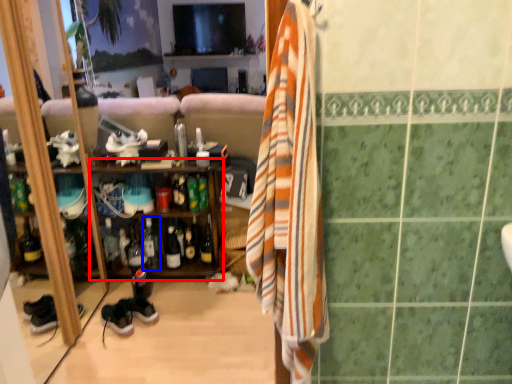
Question: Which object is closer to the camera taking this photo, shelf (highlighted by a red box) or bottle (highlighted by a blue box)?

Choices:
 (A) shelf
 (B) bottle

Answer: (A)